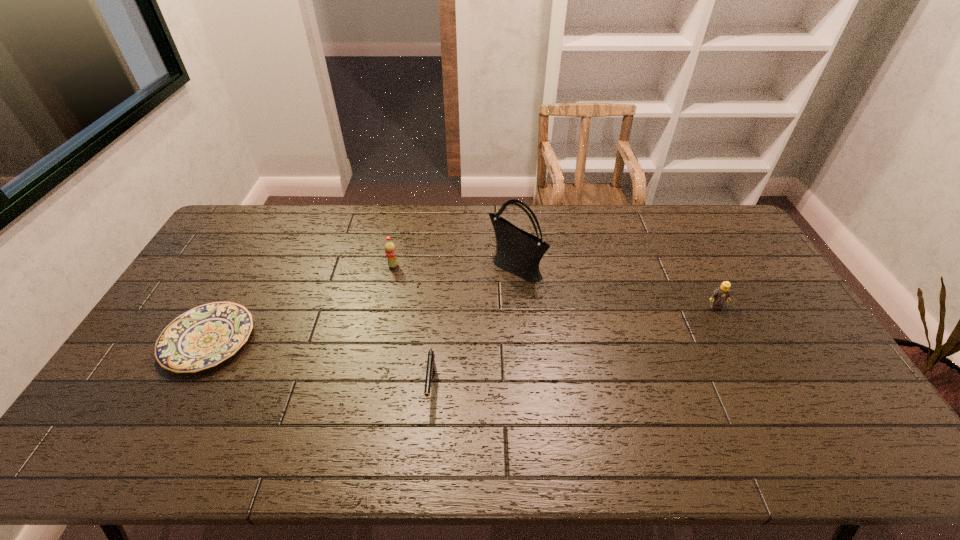
Find the location of a particular element. The height and width of the screenshot is (540, 960). free space at the far left corner of the desktop is located at coordinates (230, 229).

In the image, there is a desktop. In order to click on vacant space at the near left corner in this screenshot , I will do `click(72, 455)`.

Locate an element on the screen. This screenshot has height=540, width=960. vacant region at the near right corner of the desktop is located at coordinates (823, 431).

The image size is (960, 540). Identify the location of free area in between the leftmost object and the soda. point(301,303).

Image resolution: width=960 pixels, height=540 pixels. I want to click on free point between the Lego and the third object from right to left, so click(573, 347).

In order to click on free area in between the plate and the third object from left to right in this screenshot , I will do `click(321, 364)`.

Identify the location of empty space between the plate and the fourth object from right to left. This screenshot has height=540, width=960. (301, 303).

Locate an element on the screen. The width and height of the screenshot is (960, 540). free space between the second object from right to left and the rightmost object is located at coordinates (615, 287).

Find the location of a particular element. The height and width of the screenshot is (540, 960). empty space that is in between the soda and the Lego is located at coordinates (554, 286).

At what (x,y) coordinates should I click in order to perform the action: click on vacant region between the second tallest object and the Lego. Please return your answer as a coordinate pair (x, y). The width and height of the screenshot is (960, 540). Looking at the image, I should click on (554, 286).